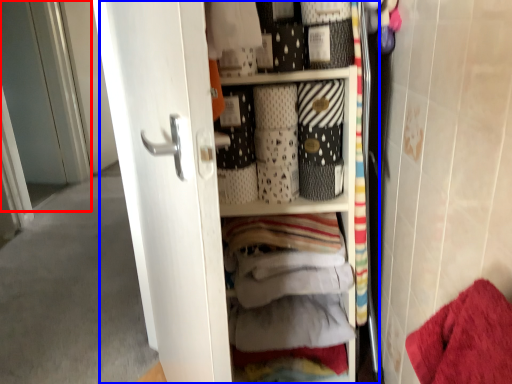
Question: Which object is further to the camera taking this photo, screen door (highlighted by a red box) or dresser (highlighted by a blue box)?

Choices:
 (A) screen door
 (B) dresser

Answer: (A)